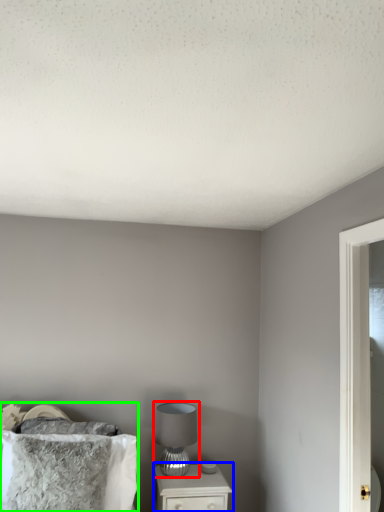
Question: Which is farther away from table lamp (highlighted by a red box)? nightstand (highlighted by a blue box) or bed (highlighted by a green box)?

Choices:
 (A) nightstand
 (B) bed

Answer: (B)